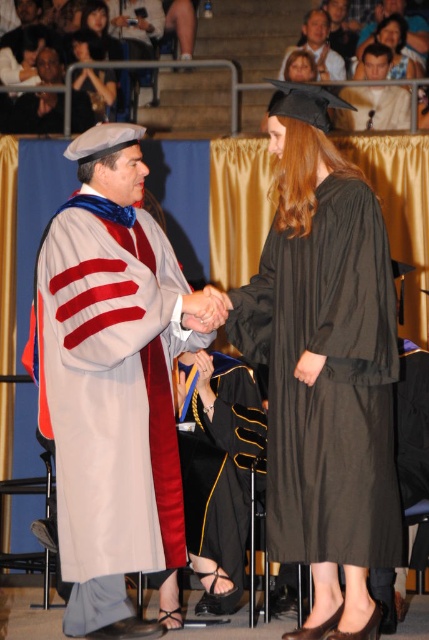
Question: Which object appears farthest from the camera in this image?

Choices:
 (A) smooth beige cap at upper center
 (B) light gray wool graduation gown at center

Answer: (A)

Question: Which point is closer to the camera taking this photo?

Choices:
 (A) (109, 72)
 (B) (326, 61)
 (C) (199, 461)
 (D) (148, 13)

Answer: (C)

Question: Is light gray wool graduation gown at center wider than smooth brown hair at upper center?

Choices:
 (A) no
 (B) yes

Answer: (B)

Question: Is light gray wool graduation gown at center to the left of matte black graduation gown at center from the viewer's perspective?

Choices:
 (A) yes
 (B) no

Answer: (B)

Question: Can you confirm if matte gray cap at upper left is positioned above matte black gown at center?

Choices:
 (A) yes
 (B) no

Answer: (B)

Question: Estimate the real-world distances between objects in this image. Which object is farther from the black matte graduation gown at center?

Choices:
 (A) smooth brown hair at upper center
 (B) black matte gown at center
 (C) matte black graduation gown at center

Answer: (C)